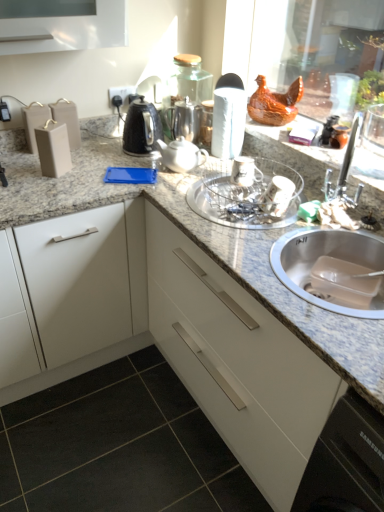
Question: Is metallic silver shaker at upper center, marked as the first appliance in a right-to-left arrangement, in front of silver metallic sink at lower right?

Choices:
 (A) yes
 (B) no

Answer: (B)

Question: Would you say metallic silver shaker at upper center, which ranks as the second appliance in left-to-right order, is outside silver metallic sink at lower right?

Choices:
 (A) yes
 (B) no

Answer: (A)

Question: From the image's perspective, does metallic silver shaker at upper center, marked as the first appliance in a right-to-left arrangement, appear lower than silver metallic sink at lower right?

Choices:
 (A) yes
 (B) no

Answer: (B)

Question: From the image's perspective, does metallic silver shaker at upper center, marked as the first appliance in a right-to-left arrangement, appear higher than silver metallic sink at lower right?

Choices:
 (A) no
 (B) yes

Answer: (B)

Question: Is metallic silver shaker at upper center, marked as the first appliance in a right-to-left arrangement, shorter than silver metallic sink at lower right?

Choices:
 (A) yes
 (B) no

Answer: (A)

Question: Considering the positions of satin silver teapot at center, placed as the first tea pot when sorted from back to front, and white matte cabinet at left, marked as the 2th cabinetry in a right-to-left arrangement, in the image, is satin silver teapot at center, placed as the first tea pot when sorted from back to front, bigger or smaller than white matte cabinet at left, marked as the 2th cabinetry in a right-to-left arrangement,?

Choices:
 (A) small
 (B) big

Answer: (A)

Question: Is satin silver teapot at center, positioned as the 2th tea pot in front-to-back order, in front of or behind white matte cabinet at left, marked as the 2th cabinetry in a right-to-left arrangement, in the image?

Choices:
 (A) behind
 (B) front

Answer: (A)

Question: Does point (195, 106) appear closer or farther from the camera than point (56, 324)?

Choices:
 (A) closer
 (B) farther

Answer: (B)

Question: From the image's perspective, is satin silver teapot at center, positioned as the 2th tea pot in front-to-back order, located above or below white matte cabinet at left, marked as the 2th cabinetry in a right-to-left arrangement?

Choices:
 (A) above
 (B) below

Answer: (A)

Question: In terms of size, does clear glass bowl at center appear bigger or smaller than satin silver teapot at center, placed as the first tea pot when sorted from back to front?

Choices:
 (A) small
 (B) big

Answer: (B)

Question: Is clear glass bowl at center taller or shorter than satin silver teapot at center, placed as the first tea pot when sorted from back to front?

Choices:
 (A) short
 (B) tall

Answer: (A)

Question: Would you say clear glass bowl at center is inside or outside satin silver teapot at center, placed as the first tea pot when sorted from back to front?

Choices:
 (A) outside
 (B) inside

Answer: (A)

Question: Is clear glass bowl at center to the left or to the right of satin silver teapot at center, placed as the first tea pot when sorted from back to front, in the image?

Choices:
 (A) left
 (B) right

Answer: (B)

Question: Is satin silver teapot at center, positioned as the 2th tea pot in front-to-back order, taller or shorter than matte gray box at left, which is the 1th appliance from left to right?

Choices:
 (A) short
 (B) tall

Answer: (A)

Question: Considering the positions of satin silver teapot at center, positioned as the 2th tea pot in front-to-back order, and matte gray box at left, which is the 1th appliance from left to right, in the image, is satin silver teapot at center, positioned as the 2th tea pot in front-to-back order, bigger or smaller than matte gray box at left, which is the 1th appliance from left to right,?

Choices:
 (A) small
 (B) big

Answer: (A)